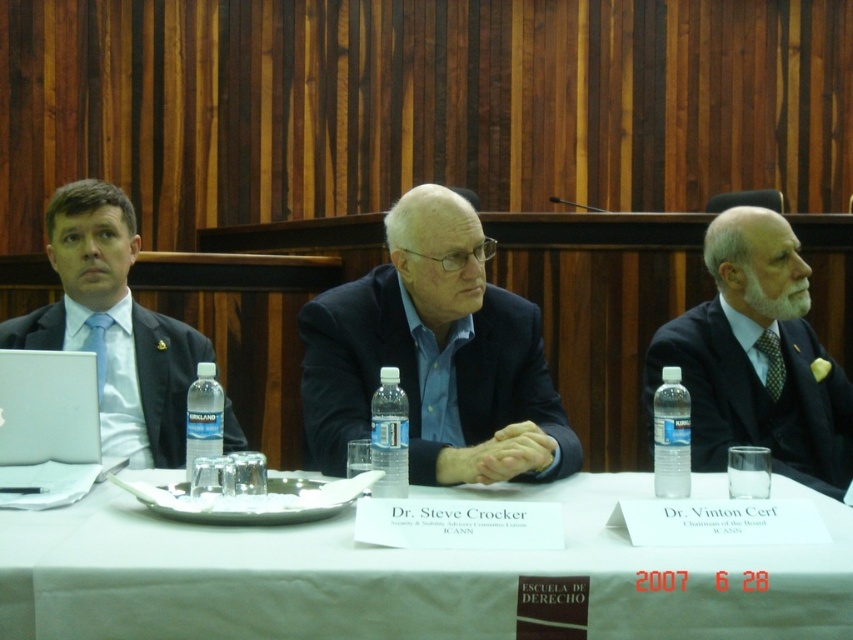
Is silver metallic laptop at left in front of clear plastic bottle at right?

No, silver metallic laptop at left is behind clear plastic bottle at right.

Based on the photo, measure the distance between point (4, 445) and camera.

Point (4, 445) and camera are 5.75 feet apart.

Which is behind, point (13, 387) or point (665, 442)?

Positioned behind is point (13, 387).

The image size is (853, 640). Identify the location of silver metallic laptop at left. [47, 406].

Is white textured suit at right wider than matte blue tie at left?

Correct, the width of white textured suit at right exceeds that of matte blue tie at left.

Does white textured suit at right appear over matte blue tie at left?

No.

Locate an element on the screen. This screenshot has width=853, height=640. white textured suit at right is located at coordinates (757, 358).

Can you confirm if clear plastic bottle at center is thinner than green textured tie at right?

Yes, clear plastic bottle at center is thinner than green textured tie at right.

Does clear plastic bottle at center appear under green textured tie at right?

Correct, clear plastic bottle at center is located below green textured tie at right.

I want to click on clear plastic bottle at center, so click(x=389, y=435).